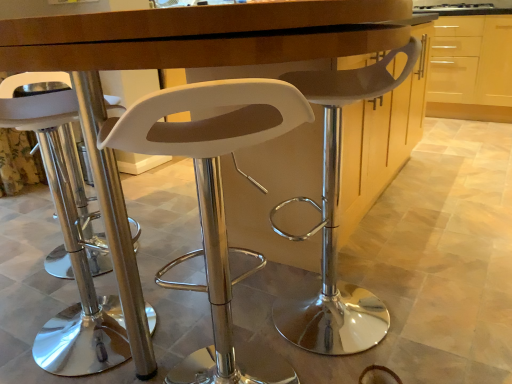
Find the location of `free space behind white plastic stool at left, positioned as the 3th chair in right-to-left order`. free space behind white plastic stool at left, positioned as the 3th chair in right-to-left order is located at coordinates (90, 268).